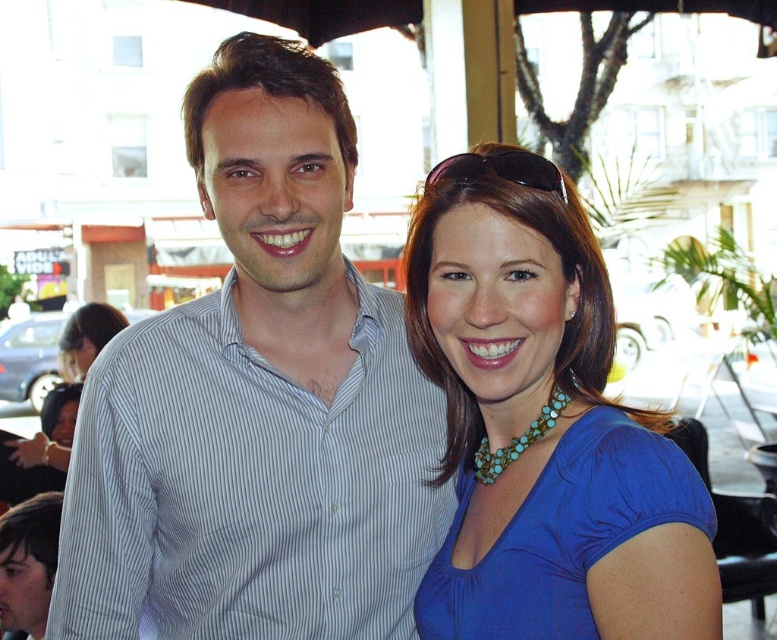
Question: Does blue fabric dress at center have a smaller size compared to turquoise beaded necklace at center?

Choices:
 (A) yes
 (B) no

Answer: (B)

Question: Estimate the real-world distances between objects in this image. Which object is farther from the turquoise beaded necklace at center?

Choices:
 (A) light blue striped shirt at center
 (B) blue fabric dress at center
 (C) blue beaded necklace at center

Answer: (A)

Question: Which point is farther to the camera?

Choices:
 (A) turquoise beaded necklace at center
 (B) blue beaded necklace at center

Answer: (A)

Question: Is blue beaded necklace at center positioned before blue fabric dress at center?

Choices:
 (A) no
 (B) yes

Answer: (B)

Question: Which is nearer to the turquoise beaded necklace at center?

Choices:
 (A) light blue striped shirt at center
 (B) blue beaded necklace at center
 (C) blue fabric dress at center

Answer: (B)

Question: Can you confirm if light blue striped shirt at center is bigger than blue beaded necklace at center?

Choices:
 (A) yes
 (B) no

Answer: (A)